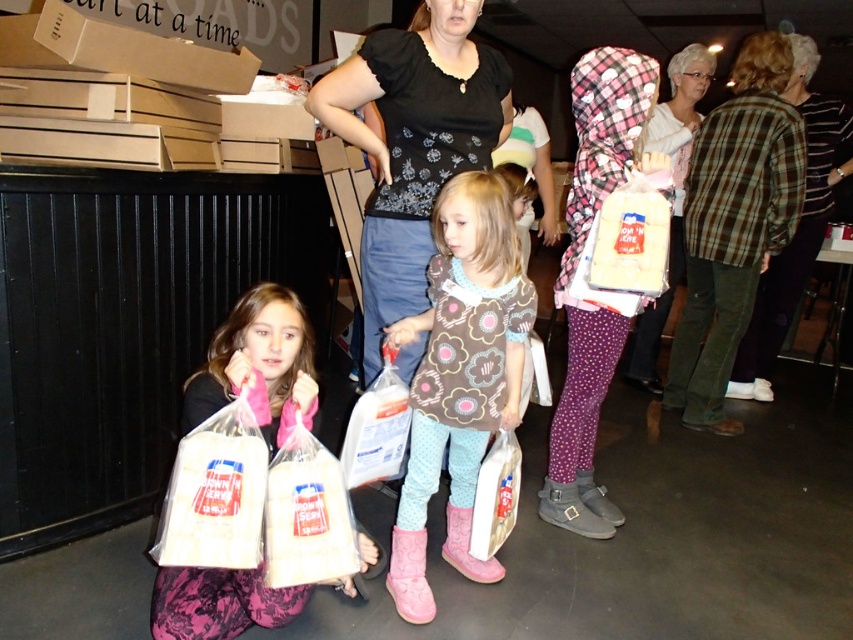
Between pink fabric dress at lower left and plaid fabric bag at upper right, which one appears on the left side from the viewer's perspective?

pink fabric dress at lower left is more to the left.

Is pink fabric dress at lower left below plaid fabric bag at upper right?

Yes, pink fabric dress at lower left is below plaid fabric bag at upper right.

Between point (294, 326) and point (672, 125), which one is positioned in front?

Point (294, 326) is in front.

Identify the location of pink fabric dress at lower left. (259, 364).

Is pink fabric dress at lower left below white paper bag at lower center?

Incorrect, pink fabric dress at lower left is not positioned below white paper bag at lower center.

Is point (256, 400) closer to camera compared to point (503, 518)?

Yes, point (256, 400) is closer to viewer.

Does point (194, 589) come farther from viewer compared to point (496, 493)?

No, (194, 589) is in front of (496, 493).

At what (x,y) coordinates should I click in order to perform the action: click on pink fabric dress at lower left. Please return your answer as a coordinate pair (x, y). This screenshot has height=640, width=853. Looking at the image, I should click on (259, 364).

Between pink fabric dress at lower left and translucent plastic bag at lower center, which one is positioned lower?

translucent plastic bag at lower center

Looking at this image, is pink fabric dress at lower left in front of translucent plastic bag at lower center?

No, pink fabric dress at lower left is behind translucent plastic bag at lower center.

Which is in front, point (294, 397) or point (299, 452)?

Point (299, 452)

This screenshot has height=640, width=853. Find the location of `pink fabric dress at lower left`. pink fabric dress at lower left is located at coordinates (259, 364).